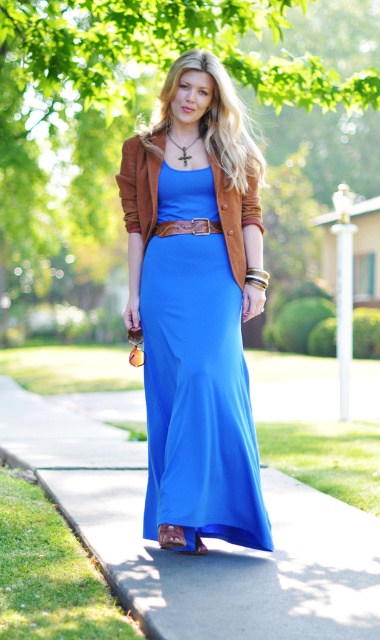
Who is higher up, smooth concrete pavement at lower center or matte brown leather belt at center?

Positioned higher is matte brown leather belt at center.

Who is positioned more to the left, smooth concrete pavement at lower center or matte brown leather belt at center?

From the viewer's perspective, smooth concrete pavement at lower center appears more on the left side.

Who is more distant from viewer, (308, 500) or (204, 227)?

The point (308, 500) is behind.

You are a GUI agent. You are given a task and a screenshot of the screen. Output one action in this format:
    pyautogui.click(x=<x>, y=<y>)
    Task: Click on the smooth concrete pavement at lower center
    This screenshot has height=640, width=380.
    Given the screenshot: What is the action you would take?
    pyautogui.click(x=204, y=540)

Can you confirm if suede jacket at center is thinner than matte brown sandal at lower center?

Incorrect, suede jacket at center's width is not less than matte brown sandal at lower center's.

Is point (128, 209) positioned before point (163, 524)?

No.

Locate an element on the screen. This screenshot has height=640, width=380. suede jacket at center is located at coordinates (140, 182).

Is satin blue dress at center taller than matte blue fabric sandal at center?

Indeed, satin blue dress at center has a greater height compared to matte blue fabric sandal at center.

Between point (183, 308) and point (159, 531), which one is positioned in front?

Point (159, 531)

The height and width of the screenshot is (640, 380). Find the location of `satin blue dress at center`. satin blue dress at center is located at coordinates (196, 378).

This screenshot has width=380, height=640. Identify the location of satin blue dress at center. (196, 378).